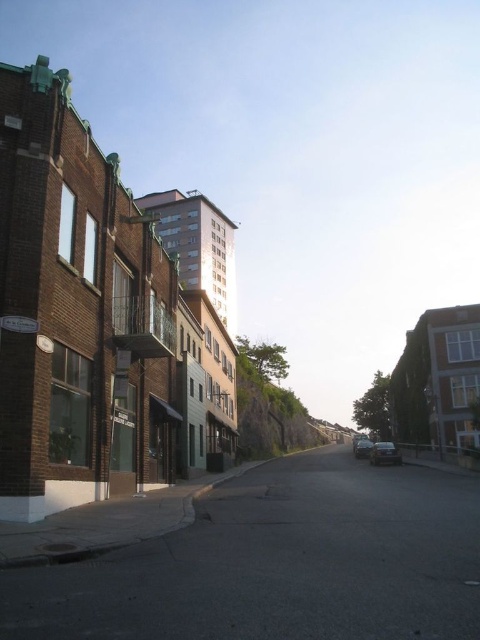
Is shiny black sedan at center to the right of shiny silver sedan at center from the viewer's perspective?

Correct, you'll find shiny black sedan at center to the right of shiny silver sedan at center.

Who is lower down, shiny black sedan at center or shiny silver sedan at center?

Positioned lower is shiny silver sedan at center.

The width and height of the screenshot is (480, 640). What are the coordinates of `shiny black sedan at center` in the screenshot? It's located at (384, 452).

Does dark asphalt road at center appear on the left side of shiny black sedan at center?

Yes, dark asphalt road at center is to the left of shiny black sedan at center.

Which is in front, point (272, 534) or point (375, 460)?

Point (272, 534)

Image resolution: width=480 pixels, height=640 pixels. In order to click on dark asphalt road at center in this screenshot , I will do `click(278, 563)`.

Between point (364, 444) and point (358, 435), which one is positioned behind?

The point (358, 435) is more distant.

Can you confirm if shiny silver sedan at center is positioned to the left of shiny silver car at center?

Indeed, shiny silver sedan at center is positioned on the left side of shiny silver car at center.

Describe the element at coordinates (362, 449) in the screenshot. The image size is (480, 640). I see `shiny silver sedan at center` at that location.

The image size is (480, 640). What are the coordinates of `shiny silver sedan at center` in the screenshot? It's located at (362, 449).